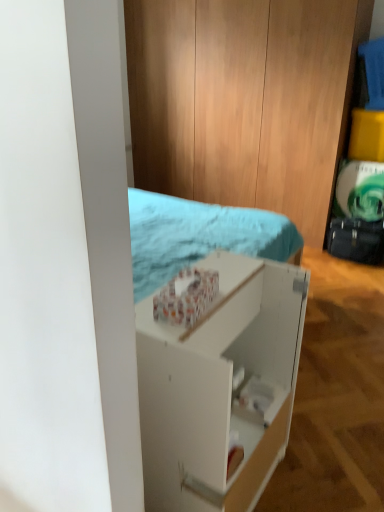
Question: From their relative heights in the image, would you say black leather suitcase at right is taller or shorter than white matte shelf at center?

Choices:
 (A) short
 (B) tall

Answer: (A)

Question: Based on their positions, is black leather suitcase at right located to the left or right of white matte shelf at center?

Choices:
 (A) left
 (B) right

Answer: (B)

Question: From a real-world perspective, relative to white matte shelf at center, is black leather suitcase at right vertically above or below?

Choices:
 (A) below
 (B) above

Answer: (A)

Question: Would you say white matte shelf at center is inside or outside black leather suitcase at right?

Choices:
 (A) outside
 (B) inside

Answer: (A)

Question: Looking at their shapes, would you say white matte shelf at center is wider or thinner than black leather suitcase at right?

Choices:
 (A) wide
 (B) thin

Answer: (A)

Question: In the image, is white matte shelf at center on the left side or the right side of black leather suitcase at right?

Choices:
 (A) right
 (B) left

Answer: (B)

Question: Relative to black leather suitcase at right, is white matte shelf at center in front or behind?

Choices:
 (A) behind
 (B) front

Answer: (B)